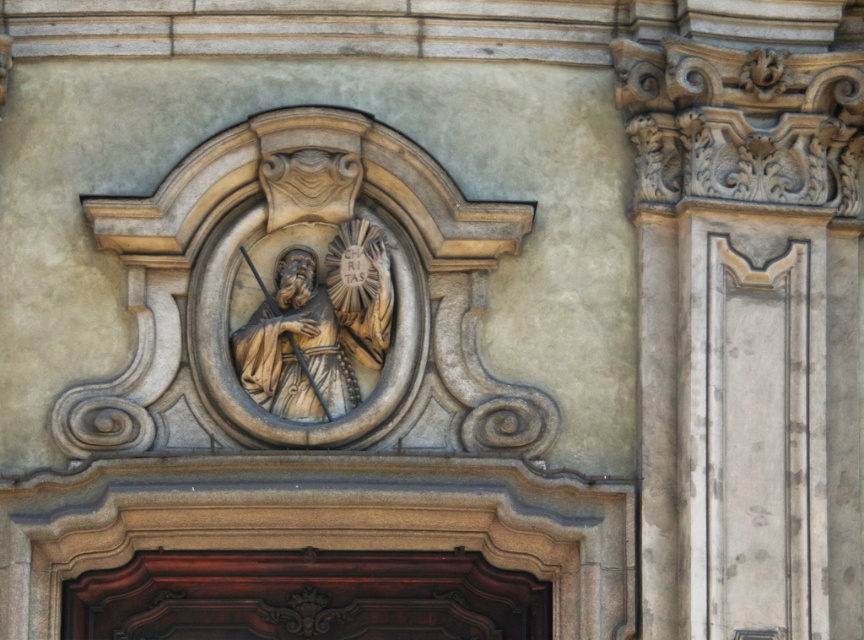
Does polished dark wood door at center appear under matte stone statue at center?

Yes.

Does polished dark wood door at center have a larger size compared to matte stone statue at center?

Actually, polished dark wood door at center might be smaller than matte stone statue at center.

Between point (322, 556) and point (345, 227), which one is positioned in front?

Point (322, 556) is in front.

At what (x,y) coordinates should I click in order to perform the action: click on polished dark wood door at center. Please return your answer as a coordinate pair (x, y). Looking at the image, I should click on (305, 596).